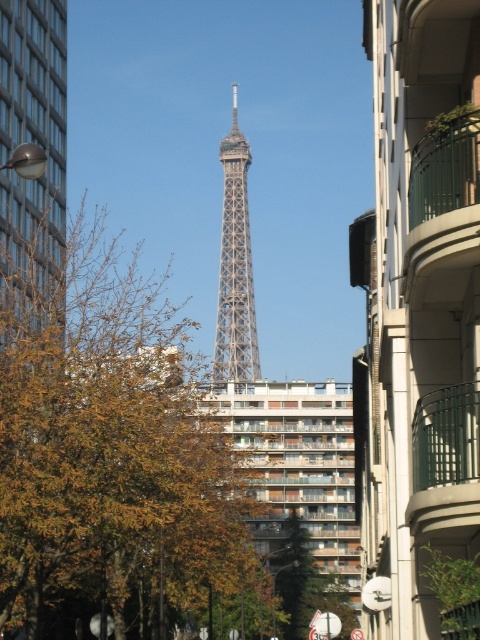
Consider the image. You are standing at the point closest to the Eiffel Tower in the image. There are two points marked in the scene, one at coordinates point (75, 237) and another at point (10, 152). Which of these points is farther away from you?

Point (75, 237) is behind point (10, 152), so it is farther away from you.

You are standing at the point with coordinates point [33,134]. Looking around, you see the Eiffel Tower in the background and modern apartment buildings with green railings. What object are you standing at?

You are standing at the metallic streetlight at left, which corresponds to the point [33,134].

You are a tourist standing in front of the Eiffel Tower and notice a brown leafy tree at center and a metallic lattice tower at center. Which object appears larger in the image?

The brown leafy tree at center is bigger than the metallic lattice tower at center, so the brown leafy tree at center appears larger in the image.